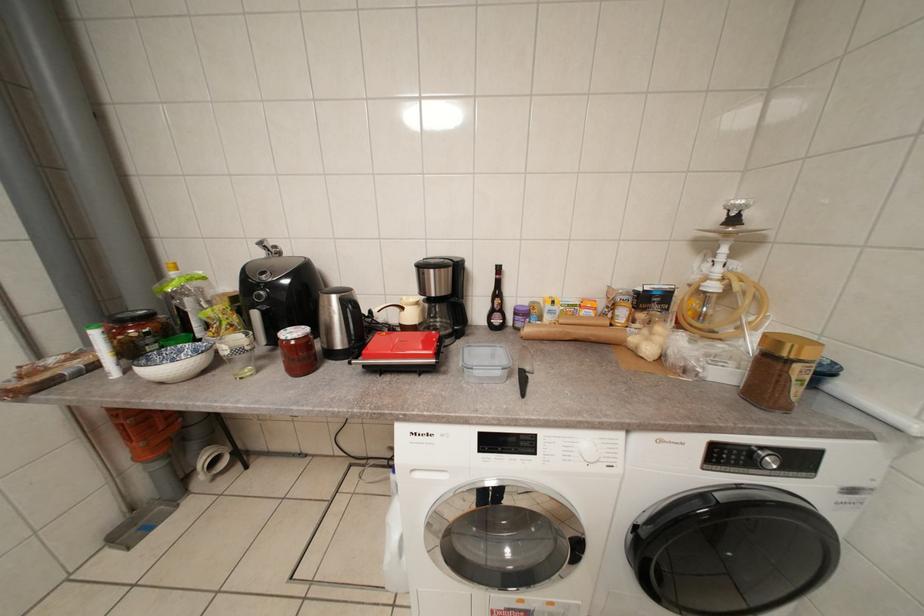
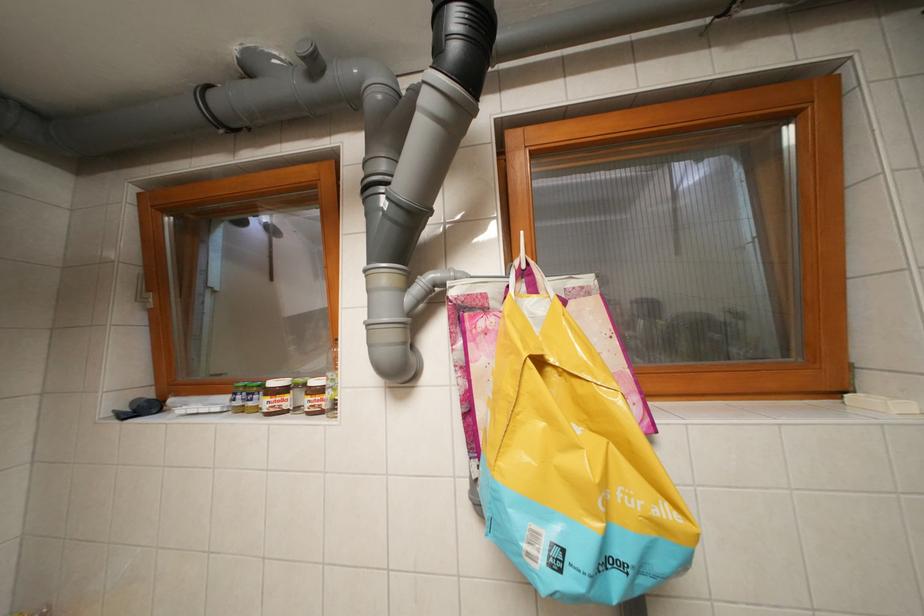
Question: How did the camera likely rotate?

Choices:
 (A) Left
 (B) Right
 (C) Up
 (D) Down

Answer: (A)